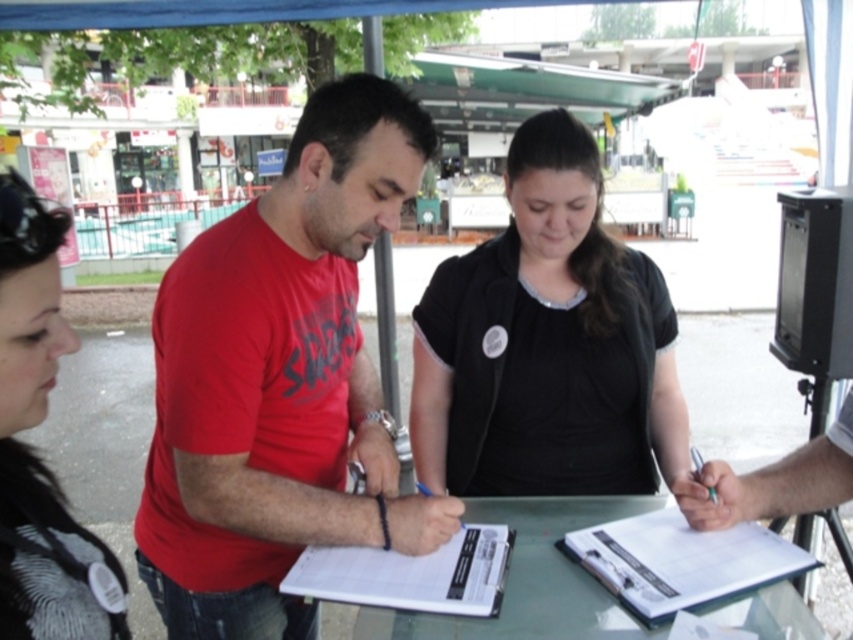
Question: From the image, what is the correct spatial relationship of matte red t-shirt at center in relation to white paper at center?

Choices:
 (A) left
 (B) right

Answer: (A)

Question: Can you confirm if matte red t-shirt at center is positioned below black matte vest at center?

Choices:
 (A) no
 (B) yes

Answer: (B)

Question: Which point is farther to the camera?

Choices:
 (A) (395, 602)
 (B) (531, 342)

Answer: (B)

Question: Which point is closer to the camera?

Choices:
 (A) black matte vest at center
 (B) white paper clipboard at center
 (C) matte red t-shirt at center
 (D) green glass table at center

Answer: (D)

Question: Which point is closer to the camera taking this photo?

Choices:
 (A) (32, 468)
 (B) (283, 323)
 (C) (306, 566)
 (D) (782, 561)

Answer: (A)

Question: From the image, what is the correct spatial relationship of matte red t-shirt at center in relation to knitted gray scarf at lower left?

Choices:
 (A) above
 (B) below

Answer: (B)